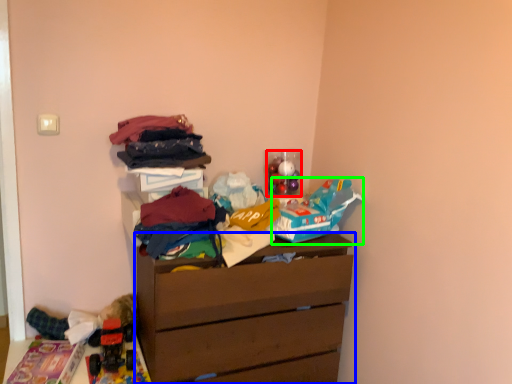
Question: Estimate the real-world distances between objects in this image. Which object is farther from toy (highlighted by a red box), chest of drawers (highlighted by a blue box) or toy (highlighted by a green box)?

Choices:
 (A) chest of drawers
 (B) toy

Answer: (A)